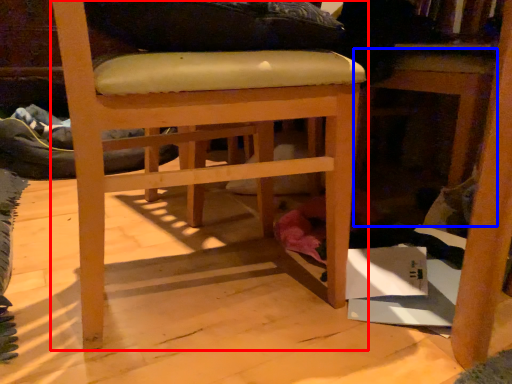
Question: Which object is further to the camera taking this photo, chair (highlighted by a red box) or table (highlighted by a blue box)?

Choices:
 (A) chair
 (B) table

Answer: (B)